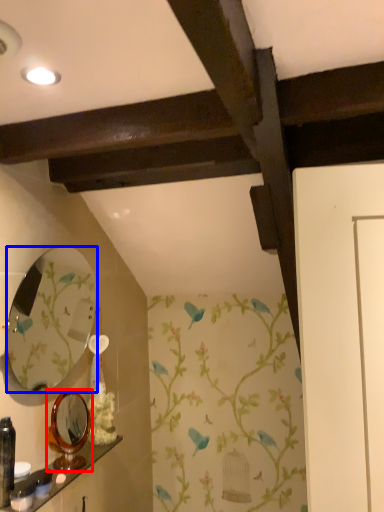
Question: Among these objects, which one is farthest to the camera, mirror (highlighted by a red box) or mirror (highlighted by a blue box)?

Choices:
 (A) mirror
 (B) mirror

Answer: (A)